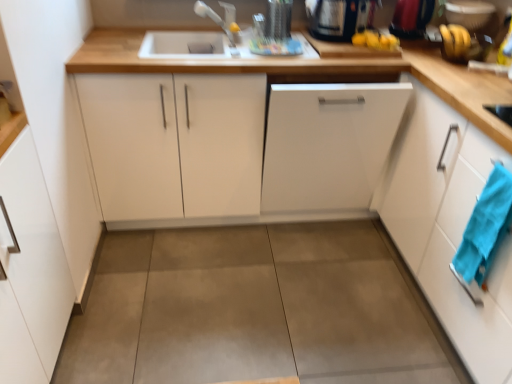
You are a GUI agent. You are given a task and a screenshot of the screen. Output one action in this format:
    pyautogui.click(x=<x>, y=<y>)
    Task: Click on the empty space that is ontop of concretesmoothfloor at center
    The image size is (512, 384).
    Given the screenshot: What is the action you would take?
    pyautogui.click(x=258, y=285)